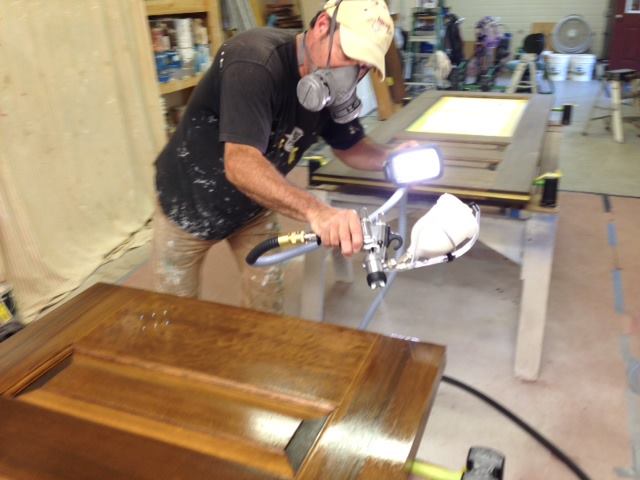
Identify the location of unpolished door. (515, 174), (538, 121), (418, 97).